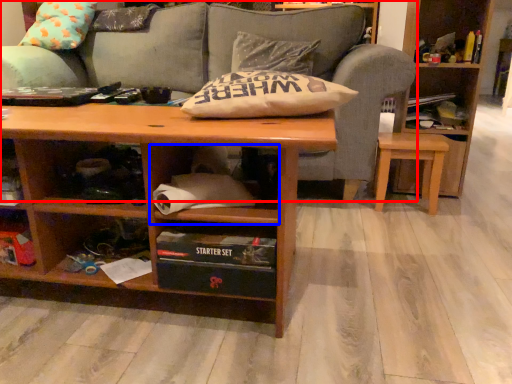
Question: Which object appears closest to the camera in this image, studio couch (highlighted by a red box) or cabinet (highlighted by a blue box)?

Choices:
 (A) studio couch
 (B) cabinet

Answer: (B)